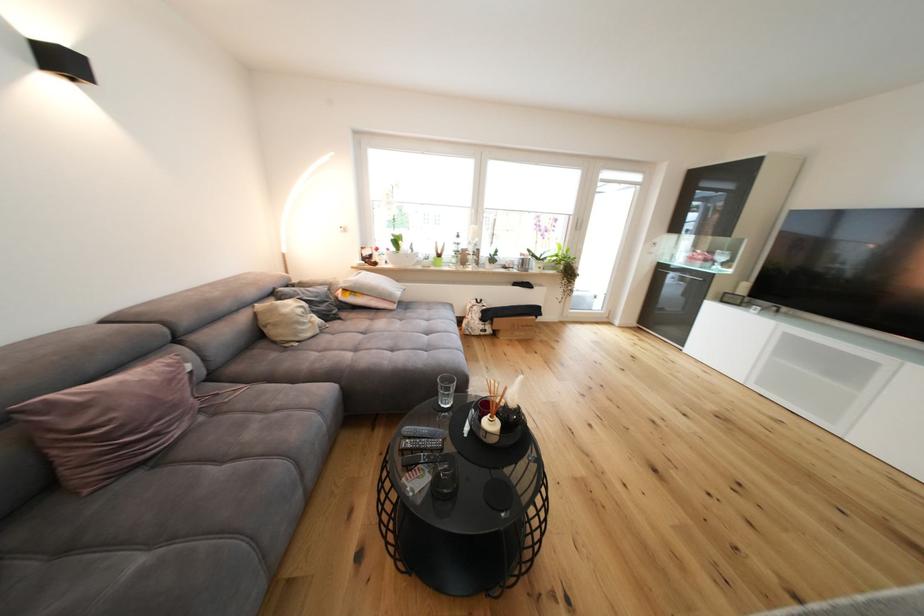
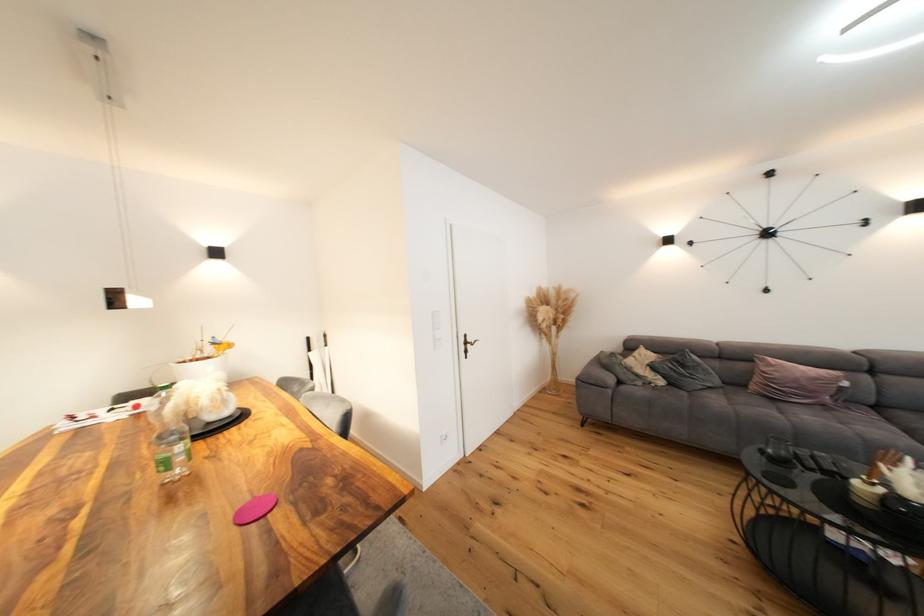
The point at (177, 384) is marked in the first image. Where is the corresponding point in the second image?

(822, 381)